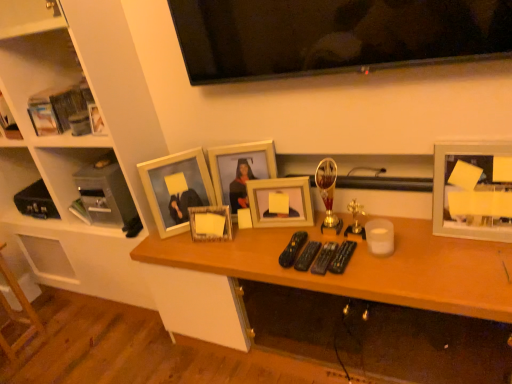
You are a GUI agent. You are given a task and a screenshot of the screen. Output one action in this format:
    pyautogui.click(x=<x>, y=<y>)
    Task: Click on the vacant space to the left of matte wooden picture frame at center, the 4th picture frame from the left
    
    Given the screenshot: What is the action you would take?
    pyautogui.click(x=246, y=240)